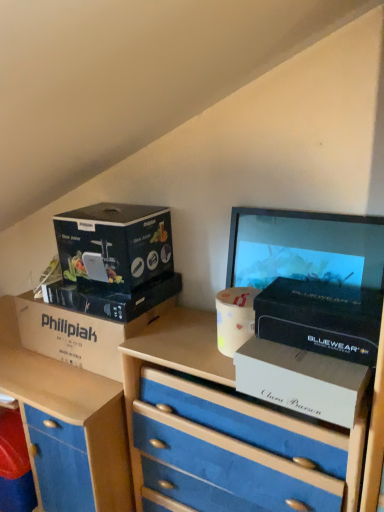
Question: Is point (127, 302) closer or farther from the camera than point (382, 245)?

Choices:
 (A) farther
 (B) closer

Answer: (A)

Question: Is matte black box at left, marked as the 3th box in a left-to-right arrangement, in front of or behind matte black computer monitor at upper right in the image?

Choices:
 (A) front
 (B) behind

Answer: (B)

Question: Estimate the real-world distances between objects in this image. Which object is farther from the blue fabric chest of drawers at center?

Choices:
 (A) white cardboard box at left, the first box positioned from the left
 (B) black matte box at center-right, which is the fifth box in left-to-right order
 (C) white cardboard box at center-right, which is counted as the 4th box, starting from the left
 (D) matte black box at upper left, the fourth box positioned from the right
 (E) matte black computer monitor at upper right

Answer: (E)

Question: Considering the real-world distances, which object is farthest from the matte black computer monitor at upper right?

Choices:
 (A) white cardboard box at center-right, which is counted as the 4th box, starting from the left
 (B) black matte box at center-right, which is the fifth box in left-to-right order
 (C) blue matte drawer at lower left
 (D) matte black box at upper left, positioned as the second box in left-to-right order
 (E) white cardboard box at left, marked as the fifth box in a right-to-left arrangement

Answer: (C)